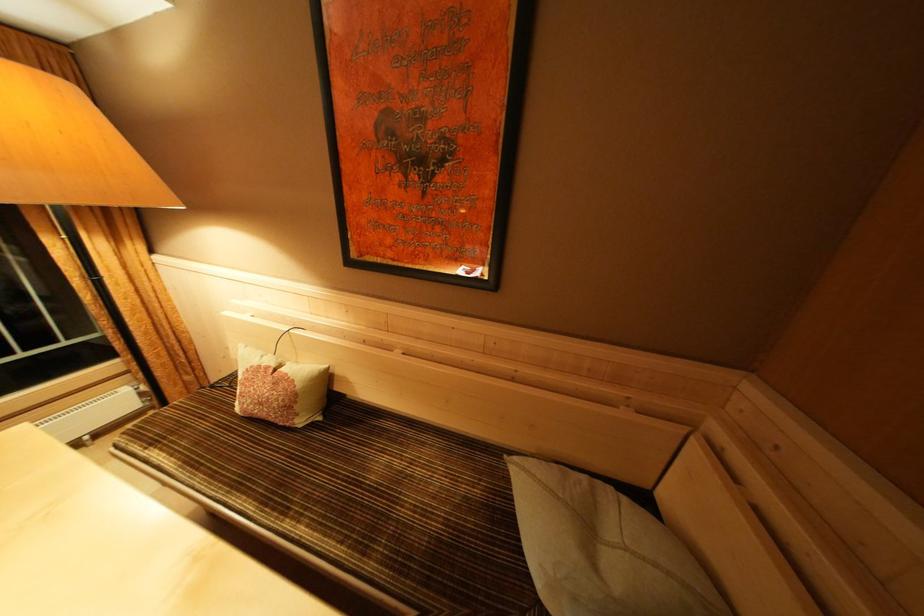
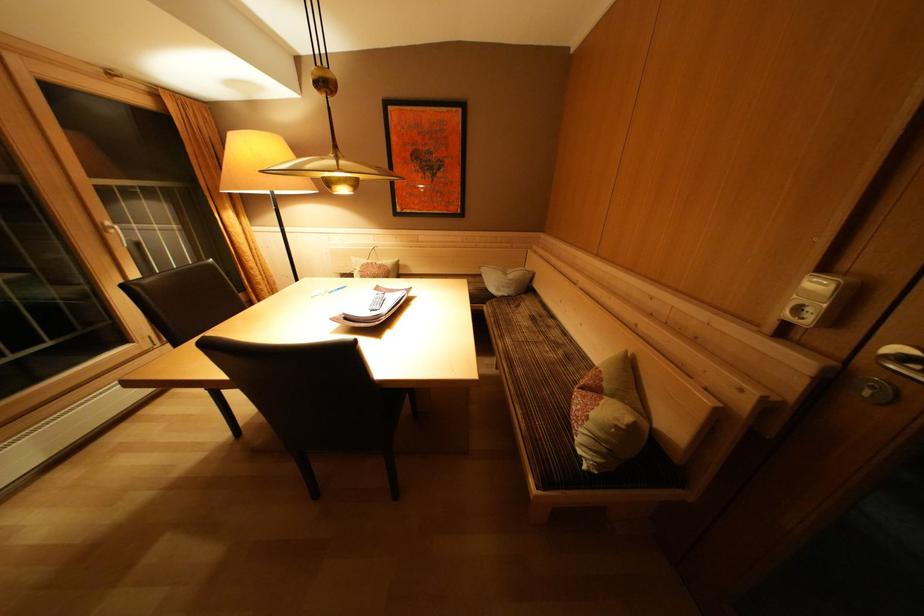
Find the pixel in the second image that matches [274,373] in the first image.

(379, 268)